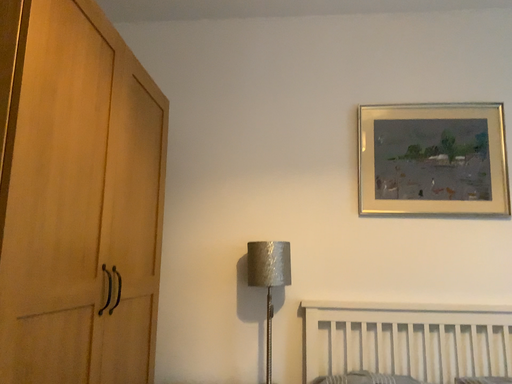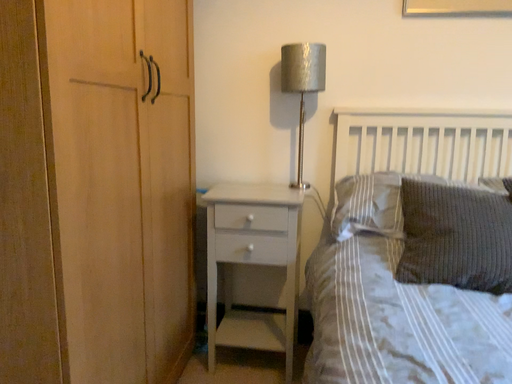
Question: How did the camera likely rotate when shooting the video?

Choices:
 (A) rotated downward
 (B) rotated upward

Answer: (A)